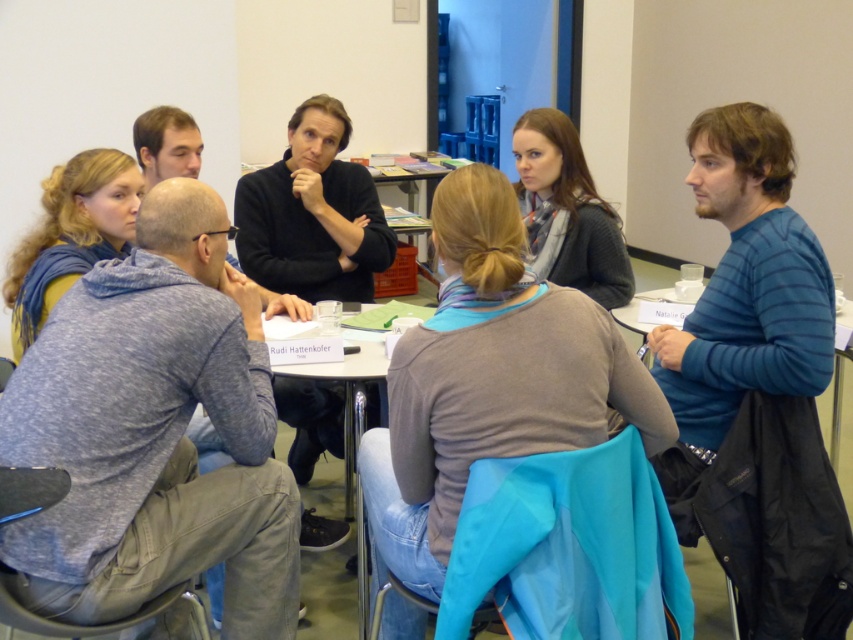
Is point (544, 122) positioned in front of point (91, 160)?

That is False.

Does knitted gray sweater at center lie in front of blue scarf at upper left?

No, knitted gray sweater at center is further to the viewer.

Is point (566, 170) positioned after point (74, 264)?

Yes.

Where is `knitted gray sweater at center`? The image size is (853, 640). knitted gray sweater at center is located at coordinates click(x=567, y=211).

What do you see at coordinates (567, 211) in the screenshot? I see `knitted gray sweater at center` at bounding box center [567, 211].

The width and height of the screenshot is (853, 640). Identify the location of knitted gray sweater at center. (567, 211).

Which is more to the left, gray sweater at center or blue scarf at upper left?

blue scarf at upper left

In order to click on gray sweater at center in this screenshot , I will do `click(490, 380)`.